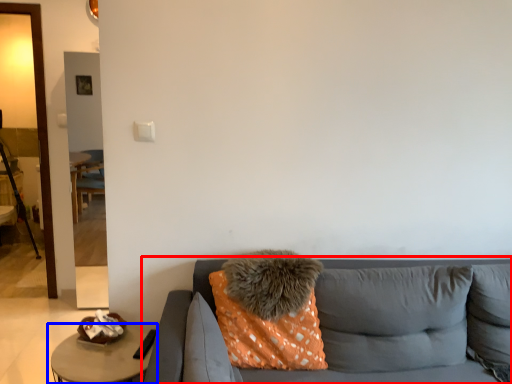
Question: Which object is further to the camera taking this photo, studio couch (highlighted by a red box) or table (highlighted by a blue box)?

Choices:
 (A) studio couch
 (B) table

Answer: (B)